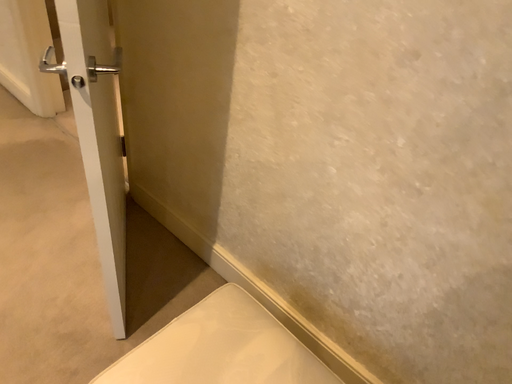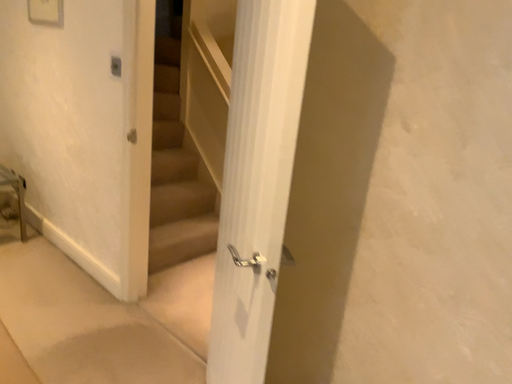
Question: How did the camera likely rotate when shooting the video?

Choices:
 (A) rotated upward
 (B) rotated downward

Answer: (A)